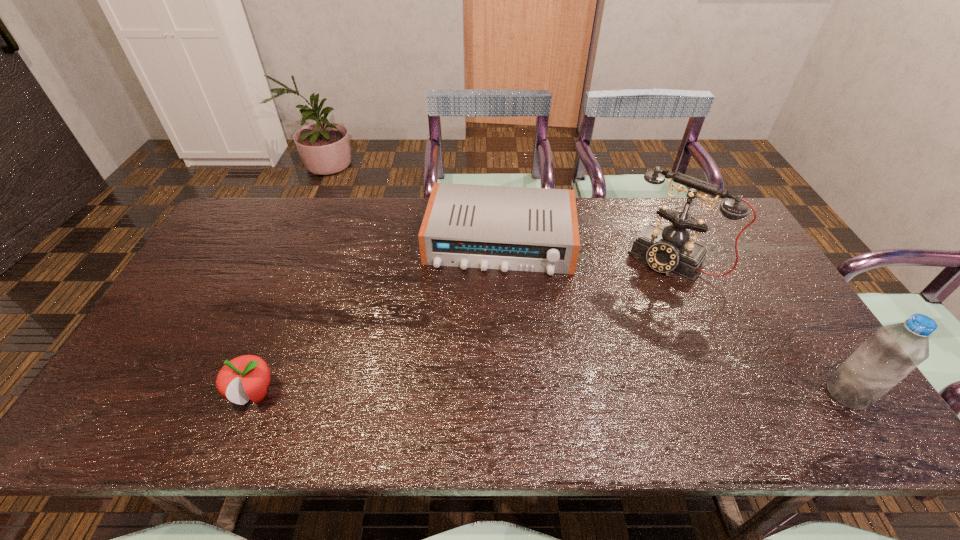
The width and height of the screenshot is (960, 540). In order to click on apple in this screenshot , I will do pos(247,377).

Identify the location of water bottle. (893, 351).

Locate an element on the screen. telephone is located at coordinates (666, 250).

The height and width of the screenshot is (540, 960). I want to click on the shortest object, so click(477, 226).

Locate an element on the screen. Image resolution: width=960 pixels, height=540 pixels. the third object from right to left is located at coordinates click(x=477, y=226).

The image size is (960, 540). Identify the location of free space located 0.170m on the left of the rightmost object. (756, 393).

Identify the location of vacant space located 0.260m on the dial of the second object from right to left. The width and height of the screenshot is (960, 540). (612, 333).

This screenshot has width=960, height=540. Identify the location of vacant space located 0.130m on the dial of the second object from right to left. (633, 304).

At what (x,y) coordinates should I click in order to perform the action: click on blank area located on the dial of the second object from right to left. Please return your answer as a coordinate pair (x, y). Looking at the image, I should click on (608, 338).

You are a GUI agent. You are given a task and a screenshot of the screen. Output one action in this format:
    pyautogui.click(x=<x>, y=<y>)
    Task: Click on the free point located 0.320m on the control panel of the second object from left to right
    
    Given the screenshot: What is the action you would take?
    pyautogui.click(x=485, y=371)